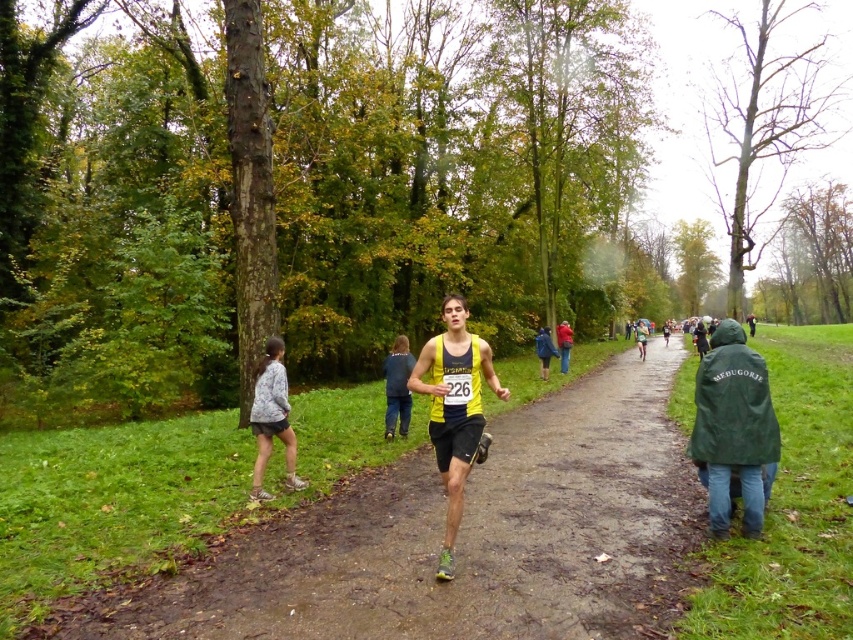
Question: Which of the following is the farthest from the observer?

Choices:
 (A) (253, 394)
 (B) (476, 364)
 (C) (735, 420)
 (D) (561, 364)

Answer: (D)

Question: Does dark blue jeans at center appear over red fabric jacket at center?

Choices:
 (A) no
 (B) yes

Answer: (A)

Question: Among these points, which one is farthest from the camera?

Choices:
 (A) (292, 554)
 (B) (485, 356)

Answer: (A)

Question: Can you confirm if yellow matte running shirt at center is positioned below red fabric jacket at center?

Choices:
 (A) no
 (B) yes

Answer: (A)

Question: Is dark blue jeans at center above red fabric jacket at center?

Choices:
 (A) yes
 (B) no

Answer: (B)

Question: Which object is farther from the camera taking this photo?

Choices:
 (A) dark blue jeans at center
 (B) yellow matte running shirt at center
 (C) green matte jacket at lower right

Answer: (A)